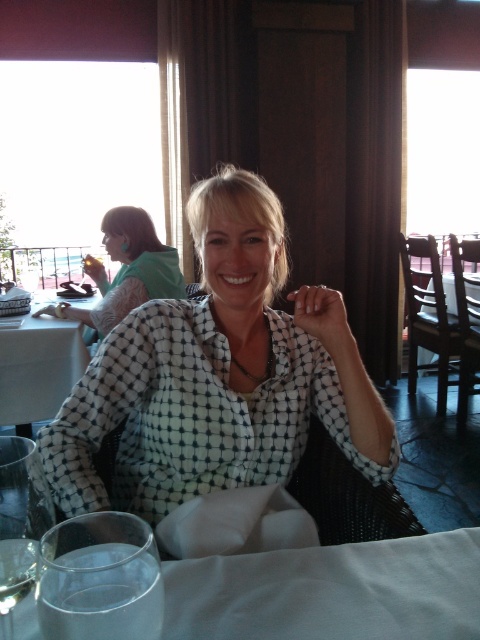
You are a waiter in a restaurant and need to place a new wine glass at the table where the woman is seated. The existing wine glass is located at point (20, 522). Where should you place the new wine glass so it doesn t interfere with the existing one?

Place the new wine glass away from point (20, 522) to avoid interference with the existing clear glass wine glass at lower left.

You are a waiter in a restaurant and need to deliver a plate to the customer wearing the white checkered shirt at center. The table closest to you is the white glossy table at left. Which direction should you move to reach the customer?

The white checkered shirt at center is to the right of the white glossy table at left, so you should move to the right to reach the customer wearing the white checkered shirt at center.